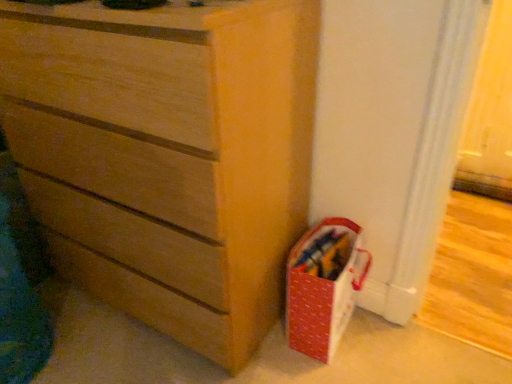
Identify the location of free space to the right of red fabric basket at lower right. The width and height of the screenshot is (512, 384). 389,339.